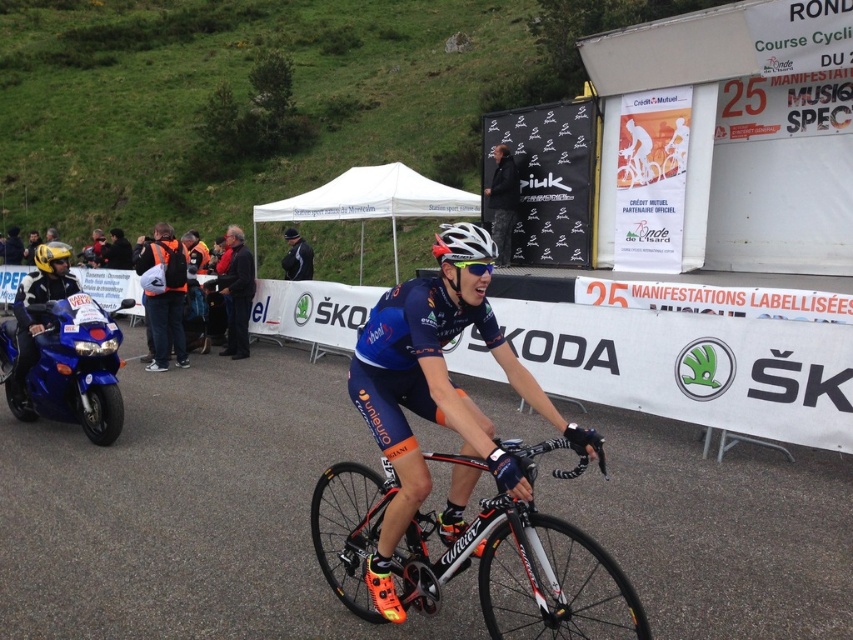
Is dark blue jacket at center below black fabric jacket at center?

Answer: Indeed, dark blue jacket at center is positioned under black fabric jacket at center.

Is dark blue jacket at center wider than black fabric jacket at center?

Incorrect, dark blue jacket at center's width does not surpass black fabric jacket at center's.

You are a GUI agent. You are given a task and a screenshot of the screen. Output one action in this format:
    pyautogui.click(x=<x>, y=<y>)
    Task: Click on the dark blue jacket at center
    The height and width of the screenshot is (640, 853).
    Given the screenshot: What is the action you would take?
    pyautogui.click(x=236, y=292)

Which of these two, dark blue jacket at center or white matte helmet at center, stands shorter?

dark blue jacket at center is shorter.

Can you confirm if dark blue jacket at center is bigger than white matte helmet at center?

No, dark blue jacket at center is not bigger than white matte helmet at center.

Find the location of `dark blue jacket at center`. dark blue jacket at center is located at coordinates (236, 292).

Which is above, white matte helmet at center or black fabric jacket at center?

black fabric jacket at center

This screenshot has width=853, height=640. What are the coordinates of `white matte helmet at center` in the screenshot? It's located at (463, 248).

From the picture: Who is more forward, (440, 224) or (294, 241)?

Point (294, 241) is in front.

Locate an element on the screen. This screenshot has height=640, width=853. white matte helmet at center is located at coordinates (463, 248).